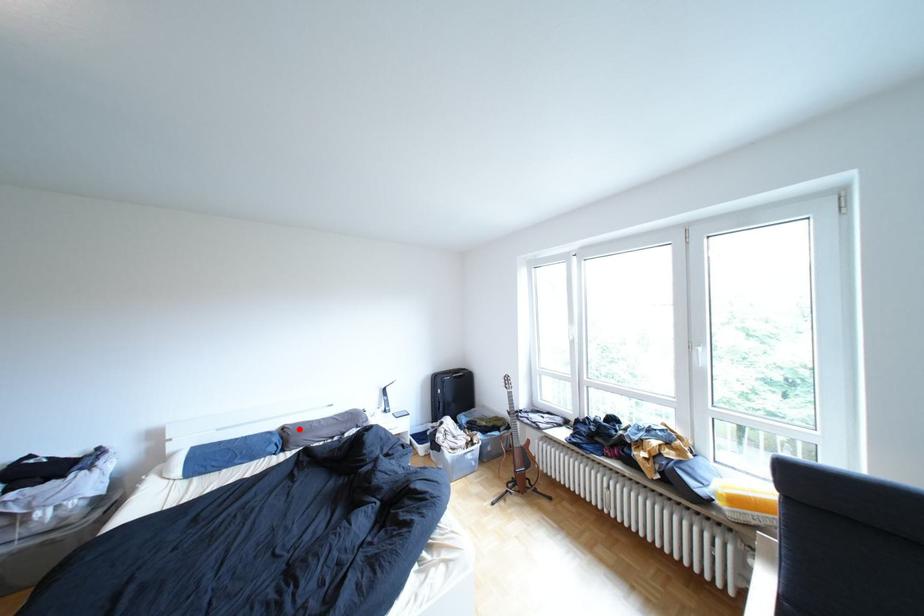
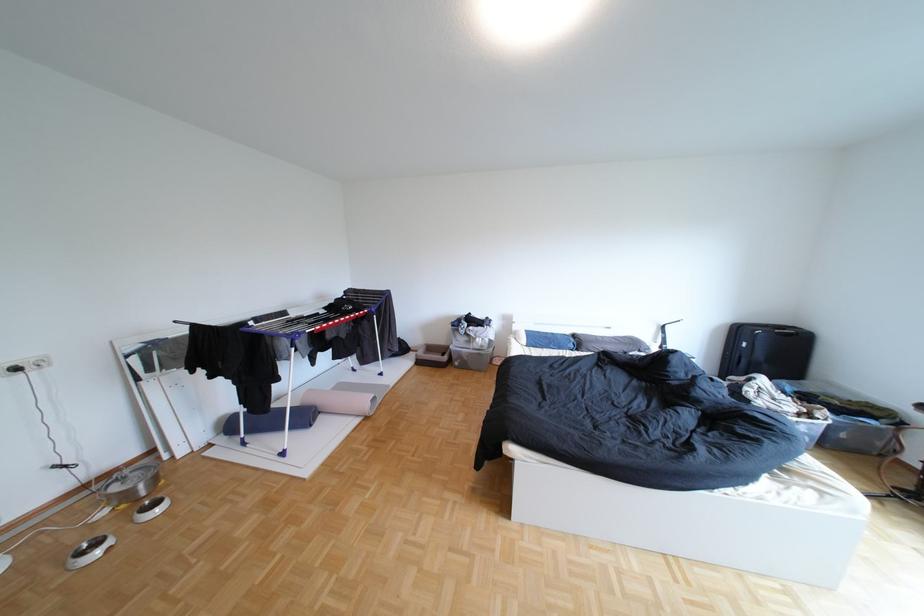
Find the pixel in the second image that matches the highlighted location in the first image.

(590, 336)